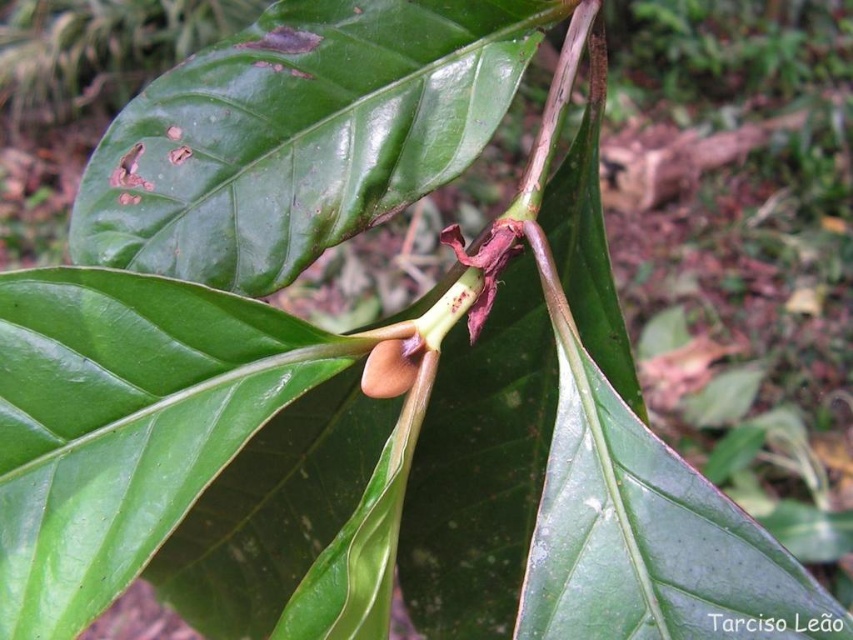
Is green matte leaf at center to the left of brown matte pod at center from the viewer's perspective?

Correct, you'll find green matte leaf at center to the left of brown matte pod at center.

This screenshot has width=853, height=640. Describe the element at coordinates (299, 134) in the screenshot. I see `green matte leaf at center` at that location.

Who is more distant from viewer, (395, 49) or (418, 352)?

The point (395, 49) is more distant.

Identify the location of green matte leaf at center. The width and height of the screenshot is (853, 640). (299, 134).